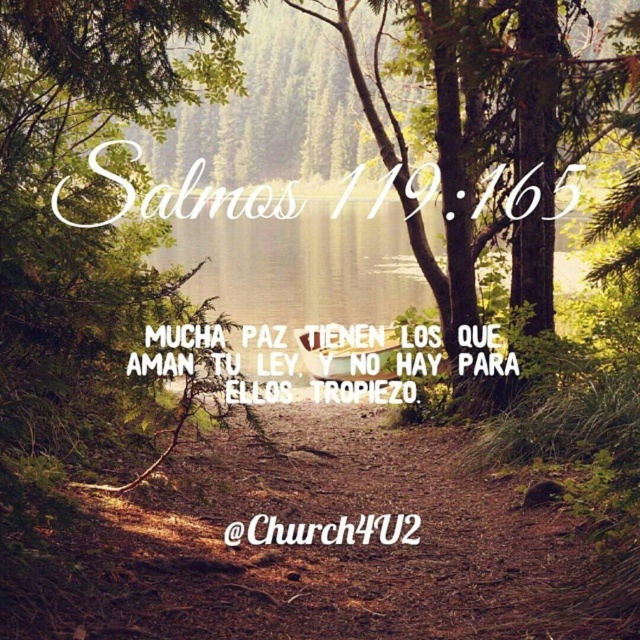
You are an artist holding a 10cm wide brush and want to paint the green matte tree at center and the white paper text at center. Which object will require more strokes to cover its area?

The green matte tree at center is larger than the white paper text at center, so it will require more strokes to cover its area.

You are a hiker who just arrived at the forest trail. You see the white script text at upper center and the white wood sign at center. Which object is bigger in size?

The white script text at upper center is larger in size compared to the white wood sign at center.